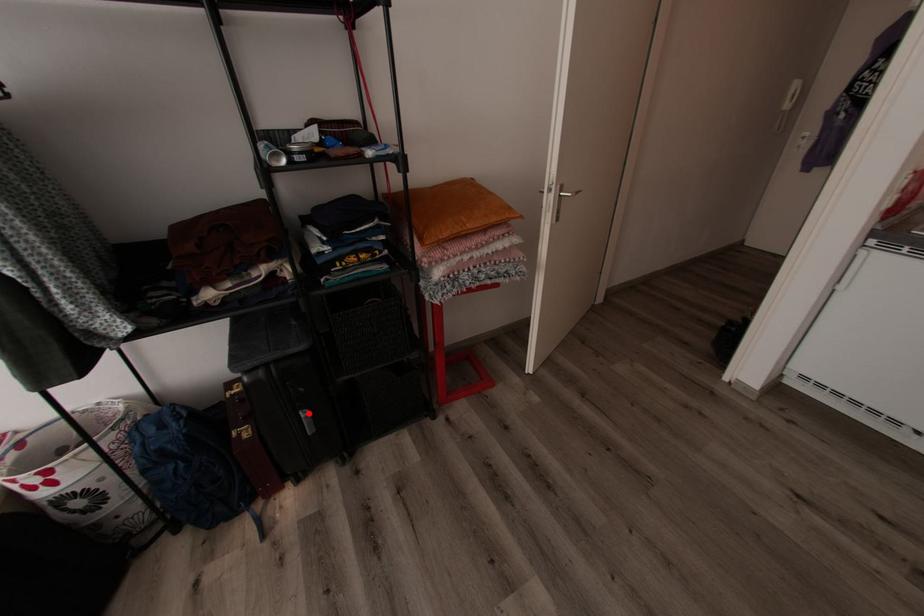
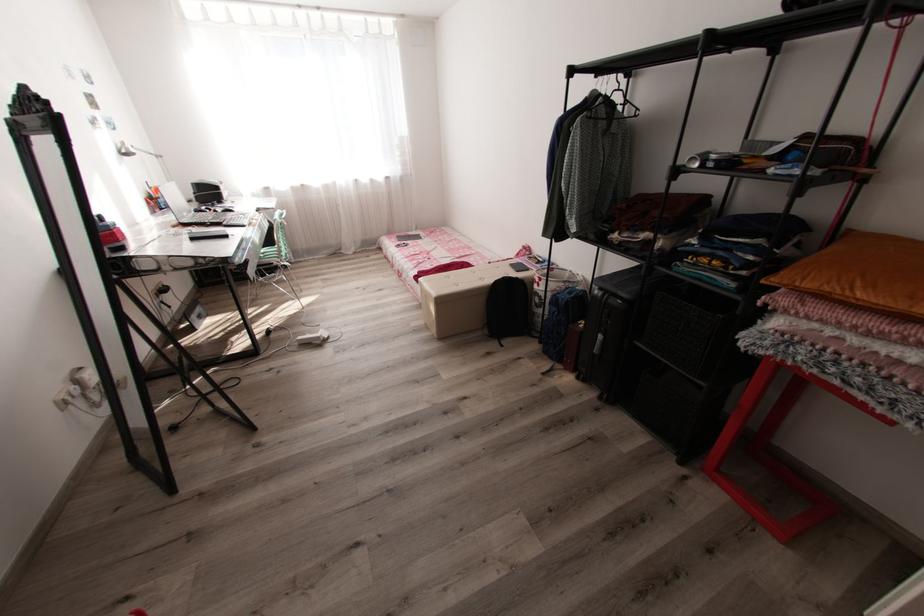
Question: I am providing you with two images of the same scene from different viewpoints. Given a red point in image1, look at the same physical point in image2. Is it:

Choices:
 (A) Closer to the viewpoint
 (B) Farther from the viewpoint

Answer: (A)